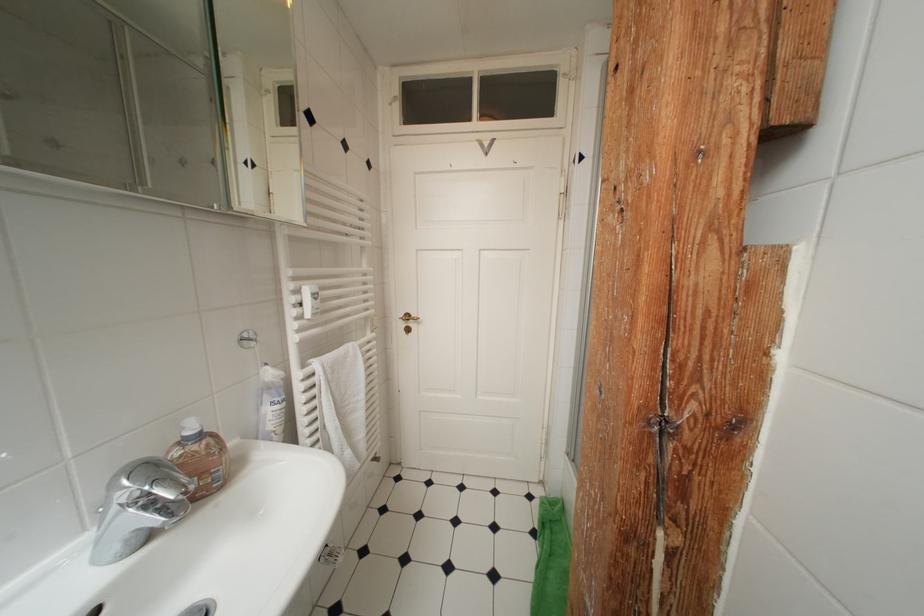
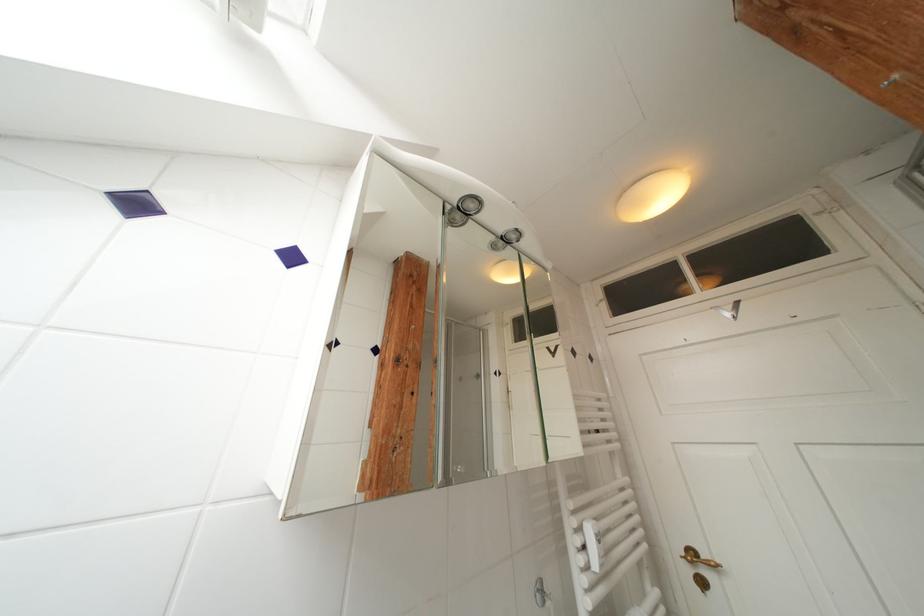
The point at (489,147) is marked in the first image. Where is the corresponding point in the second image?

(724, 312)